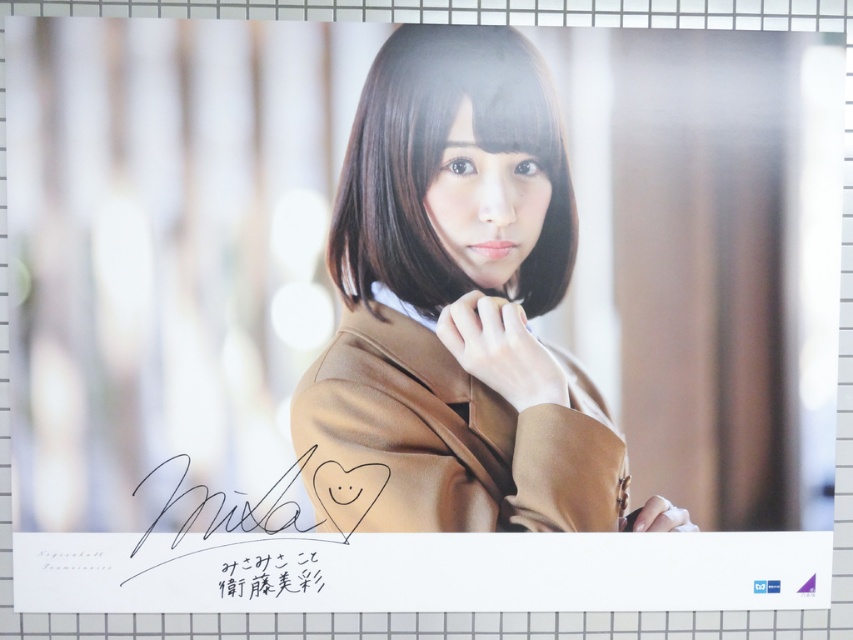
Question: Which object is the farthest from the brown silky hair at center?

Choices:
 (A) matte brown trench coat at center
 (B) black ink signature at lower center
 (C) matte brown coat at center

Answer: (B)

Question: Can you confirm if brown silky hair at center is positioned to the right of black ink signature at lower center?

Choices:
 (A) no
 (B) yes

Answer: (B)

Question: Does matte brown coat at center appear on the right side of brown silky hair at center?

Choices:
 (A) no
 (B) yes

Answer: (B)

Question: Is matte brown coat at center closer to the viewer compared to brown silky hair at center?

Choices:
 (A) yes
 (B) no

Answer: (B)

Question: Among these points, which one is nearest to the camera?

Choices:
 (A) (544, 477)
 (B) (430, 118)

Answer: (B)

Question: Which point is closer to the camera?

Choices:
 (A) (469, 92)
 (B) (335, 500)
 (C) (546, 147)
 (D) (251, 596)

Answer: (A)